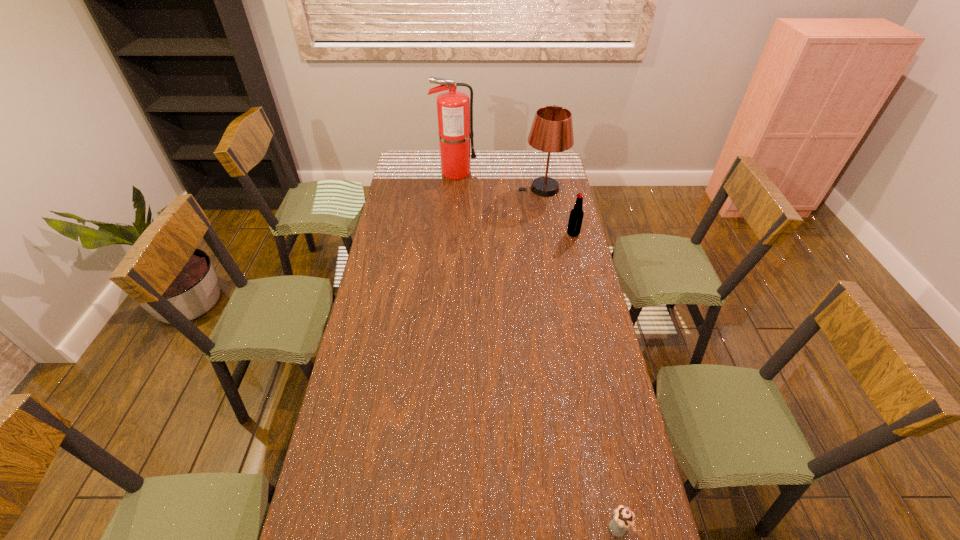
I want to click on fire extinguisher, so click(x=454, y=108).

Find the location of a particular element. This screenshot has height=540, width=960. lampshade is located at coordinates (552, 130).

The width and height of the screenshot is (960, 540). I want to click on the second nearest object, so click(576, 215).

This screenshot has width=960, height=540. Identify the location of beer bottle. (576, 215).

This screenshot has width=960, height=540. What are the coordinates of `free space located at the nozzle of the leftmost object` in the screenshot? It's located at (542, 172).

The image size is (960, 540). I want to click on vacant space situated on the front-facing side of the lampshade, so click(505, 188).

Locate an element on the screen. This screenshot has width=960, height=540. free space located on the front-facing side of the lampshade is located at coordinates (442, 188).

You are a GUI agent. You are given a task and a screenshot of the screen. Output one action in this format:
    pyautogui.click(x=<x>, y=<y>)
    Task: Click on the blank space located on the front-facing side of the lampshade
    The height and width of the screenshot is (540, 960).
    Given the screenshot: What is the action you would take?
    pyautogui.click(x=503, y=188)

At what (x,y) coordinates should I click in order to perform the action: click on free space located 0.090m on the left of the third farthest object. Please return your answer as a coordinate pair (x, y). Looking at the image, I should click on (546, 234).

Locate an element on the screen. object at the far edge is located at coordinates (454, 108).